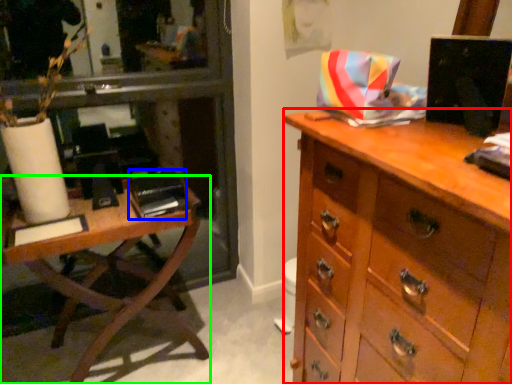
Question: Based on their relative distances, which object is nearer to chest of drawers (highlighted by a red box)? Choose from book (highlighted by a blue box) and table (highlighted by a green box).

Choices:
 (A) book
 (B) table

Answer: (A)